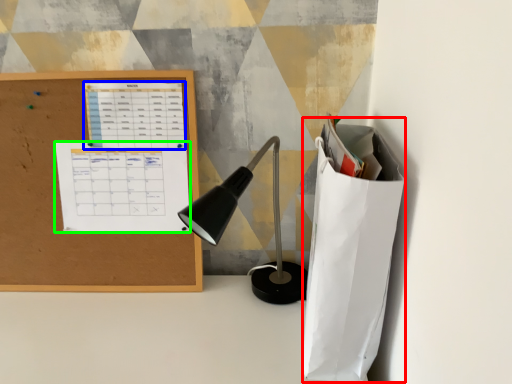
Question: Based on their relative distances, which object is nearer to paper bag (highlighted by a red box)? Choose from notebook (highlighted by a blue box) and notebook (highlighted by a green box).

Choices:
 (A) notebook
 (B) notebook

Answer: (B)